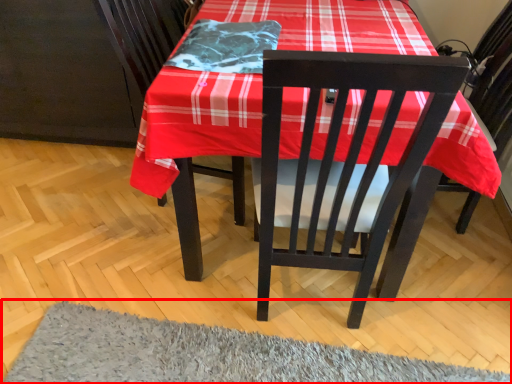
Question: From the image, what is the correct spatial relationship of mat (annotated by the red box) in relation to blanket?

Choices:
 (A) left
 (B) right

Answer: (B)